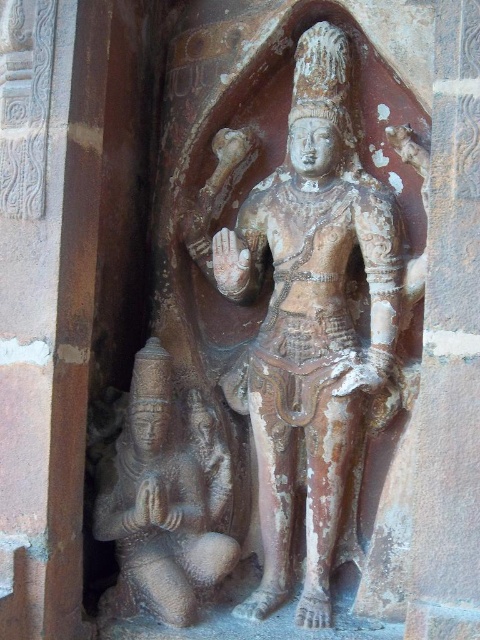
You are an archaeologist examining the stone sculpture. You notice two points on the sculpture. The first point is at coordinates point (313, 424) and the second is at point (206, 442). From your viewpoint, which point is closer to you?

Point (313, 424) is in front of point (206, 442), so it is closer to you.

You are an archaeologist examining the temple wall. You notice two statues, the brown stone statue at center and the rusty stone statue at lower left. Which statue would cast a longer shadow if the sun is directly overhead?

The brown stone statue at center is larger in size than the rusty stone statue at lower left, so it would cast a longer shadow.

You are an art conservator assessing the space between two statues in a temple niche. You need to place a protective barrier between the brown stone statue at center and the rusty stone statue at lower left. Based on their widths, can you determine if the barrier will fit if it requires at least 1 meter of space?

The brown stone statue at center might be wider than rusty stone statue at lower left, but without exact measurements, it is uncertain whether the required 1 meter of space will be available for the protective barrier.